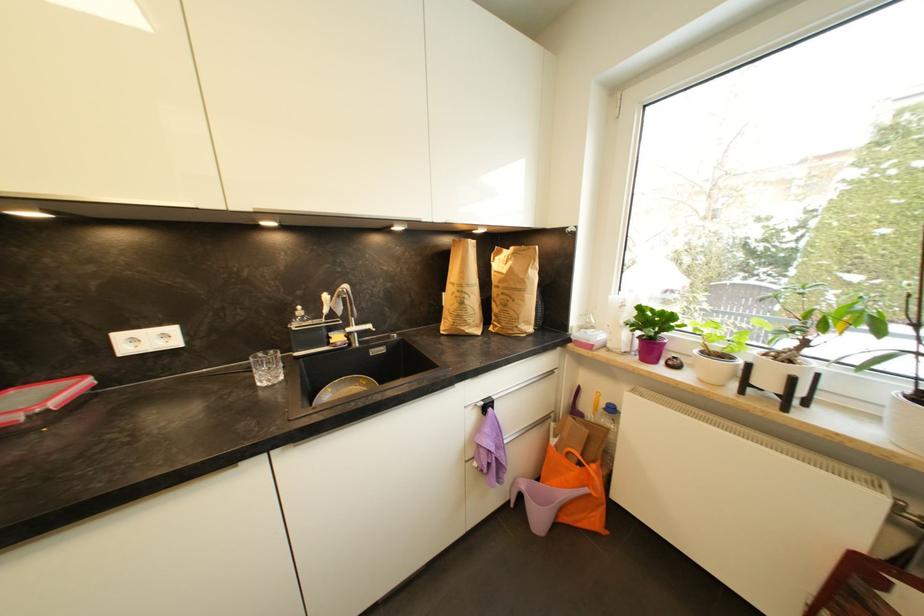
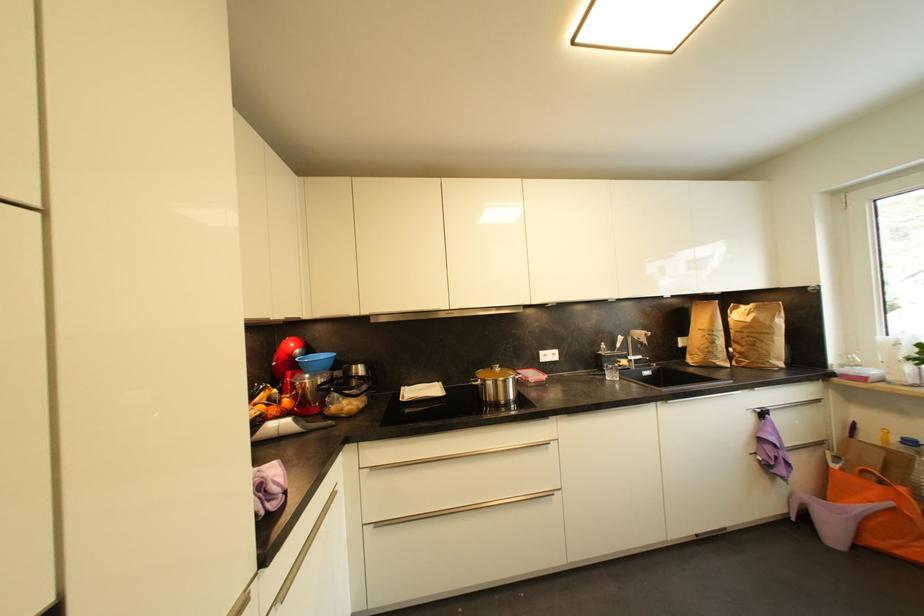
Where in the second image is the point corresponding to [373,329] from the first image?

(645, 359)